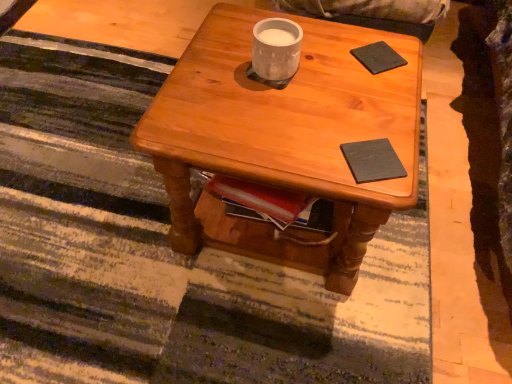
What do you see at coordinates (372, 161) in the screenshot? I see `dark matte book at center, positioned as the second pad in back-to-front order` at bounding box center [372, 161].

What do you see at coordinates (283, 138) in the screenshot? I see `wooden coffee table at center` at bounding box center [283, 138].

The image size is (512, 384). I want to click on dark matte book at center, the second pad from the top, so click(x=372, y=161).

Measure the distance between dark matte book at center, the 1th pad positioned from the bottom, and wooden coffee table at center.

They are 11.14 inches apart.

Consider the image. Between dark matte book at center, positioned as the second pad in back-to-front order, and wooden coffee table at center, which one has larger width?

wooden coffee table at center is wider.

Which is further, (362, 153) or (158, 139)?

Point (158, 139)

From the picture: Could you tell me if dark matte book at center, which is the first pad from front to back, is turned towards wooden coffee table at center?

Yes, dark matte book at center, which is the first pad from front to back, is turned towards wooden coffee table at center.

From a real-world perspective, is black matte pad at upper right, which is the first pad in top-to-bottom order, physically located above or below wooden coffee table at center?

Clearly, from a real-world perspective, black matte pad at upper right, which is the first pad in top-to-bottom order, is above wooden coffee table at center.

This screenshot has width=512, height=384. Find the location of `desk that is in front of the black matte pad at upper right, the second pad in the front-to-back sequence`. desk that is in front of the black matte pad at upper right, the second pad in the front-to-back sequence is located at coordinates (283, 138).

How many degrees apart are the facing directions of black matte pad at upper right, placed as the second pad when sorted from bottom to top, and wooden coffee table at center?

They differ by 45.8 degrees in their facing directions.

Based on their positions, is black matte pad at upper right, placed as the second pad when sorted from bottom to top, located to the left or right of wooden coffee table at center?

From the image, it's evident that black matte pad at upper right, placed as the second pad when sorted from bottom to top, is to the right of wooden coffee table at center.

In terms of width, does black matte pad at upper right, placed as the second pad when sorted from bottom to top, look wider or thinner when compared to white matte cup at center?

black matte pad at upper right, placed as the second pad when sorted from bottom to top, is wider than white matte cup at center.

Is black matte pad at upper right, which is the first pad in top-to-bottom order, facing away from white matte cup at center?

black matte pad at upper right, which is the first pad in top-to-bottom order, is not turned away from white matte cup at center.

From the image's perspective, would you say black matte pad at upper right, placed as the second pad when sorted from bottom to top, is positioned over white matte cup at center?

Yes, from the image's perspective, black matte pad at upper right, placed as the second pad when sorted from bottom to top, is on top of white matte cup at center.

From the image's perspective, between black matte pad at upper right, which is the first pad in top-to-bottom order, and dark matte book at center, which is the first pad from front to back, who is located below?

dark matte book at center, which is the first pad from front to back, from the image's perspective.

Can you tell me how much black matte pad at upper right, the second pad in the front-to-back sequence, and dark matte book at center, the second pad from the top, differ in facing direction?

The angular difference between black matte pad at upper right, the second pad in the front-to-back sequence, and dark matte book at center, the second pad from the top, is 74.3 degrees.

Does black matte pad at upper right, the first pad viewed from the back, have a greater width compared to dark matte book at center, the second pad from the top?

Yes, black matte pad at upper right, the first pad viewed from the back, is wider than dark matte book at center, the second pad from the top.

Is white matte cup at center not within dark matte book at center, which is the first pad from front to back?

Indeed, white matte cup at center is completely outside dark matte book at center, which is the first pad from front to back.

From a real-world perspective, is white matte cup at center physically above dark matte book at center, the second pad from the top?

Yes, from a real-world perspective, white matte cup at center is above dark matte book at center, the second pad from the top.

Locate an element on the screen. The width and height of the screenshot is (512, 384). pad that is the 1st object to the right of the white matte cup at center, starting at the anchor is located at coordinates (372, 161).

What's the angular difference between white matte cup at center and dark matte book at center, positioned as the second pad in back-to-front order,'s facing directions?

120 degrees separate the facing orientations of white matte cup at center and dark matte book at center, positioned as the second pad in back-to-front order.

Considering the positions of objects wooden coffee table at center and dark matte book at center, positioned as the second pad in back-to-front order, in the image provided, who is more to the left, wooden coffee table at center or dark matte book at center, positioned as the second pad in back-to-front order,?

wooden coffee table at center.

Which is in front, point (315, 89) or point (366, 157)?

The point (366, 157) is more forward.

Can you confirm if wooden coffee table at center is wider than dark matte book at center, positioned as the second pad in back-to-front order?

Indeed, wooden coffee table at center has a greater width compared to dark matte book at center, positioned as the second pad in back-to-front order.

Can you tell me how much white matte cup at center and black matte pad at upper right, the second pad in the front-to-back sequence, differ in facing direction?

There is a 45.6-degree angle between the facing directions of white matte cup at center and black matte pad at upper right, the second pad in the front-to-back sequence.

From a real-world perspective, is white matte cup at center over black matte pad at upper right, the second pad in the front-to-back sequence?

Yes.

Does point (259, 26) come farther from viewer compared to point (362, 46)?

That is False.

Who is shorter, white matte cup at center or black matte pad at upper right, the first pad viewed from the back?

black matte pad at upper right, the first pad viewed from the back, is shorter.

The width and height of the screenshot is (512, 384). I want to click on the 1st pad to the right when counting from the wooden coffee table at center, so click(372, 161).

From a real-world perspective, which pad is the 2nd one above the wooden coffee table at center? Please provide its 2D coordinates.

[(378, 57)]

Looking at the image, which one is located closer to white matte cup at center, black matte pad at upper right, which is the first pad in top-to-bottom order, or wooden coffee table at center?

black matte pad at upper right, which is the first pad in top-to-bottom order, lies closer to white matte cup at center than the other object.

Looking at the image, which one is located further to black matte pad at upper right, the first pad viewed from the back, white matte cup at center or wooden coffee table at center?

wooden coffee table at center.

Based on their spatial positions, is dark matte book at center, the second pad from the top, or black matte pad at upper right, which is the first pad in top-to-bottom order, further from wooden coffee table at center?

black matte pad at upper right, which is the first pad in top-to-bottom order, is positioned further to the anchor wooden coffee table at center.

In the scene shown: Looking at the image, which one is located closer to dark matte book at center, the second pad from the top, black matte pad at upper right, the first pad viewed from the back, or white matte cup at center?

white matte cup at center is closer to dark matte book at center, the second pad from the top.

Considering their positions, is wooden coffee table at center positioned further to dark matte book at center, the 1th pad positioned from the bottom, than white matte cup at center?

wooden coffee table at center lies further to dark matte book at center, the 1th pad positioned from the bottom, than the other object.

Estimate the real-world distances between objects in this image. Which object is further from white matte cup at center, wooden coffee table at center or black matte pad at upper right, which is the first pad in top-to-bottom order?

Among the two, wooden coffee table at center is located further to white matte cup at center.

Considering their positions, is wooden coffee table at center positioned closer to dark matte book at center, the 1th pad positioned from the bottom, than black matte pad at upper right, placed as the second pad when sorted from bottom to top?

wooden coffee table at center.

Based on their spatial positions, is dark matte book at center, the 1th pad positioned from the bottom, or white matte cup at center closer to black matte pad at upper right, the second pad in the front-to-back sequence?

white matte cup at center is positioned closer to the anchor black matte pad at upper right, the second pad in the front-to-back sequence.

The width and height of the screenshot is (512, 384). I want to click on desk between white matte cup at center and dark matte book at center, the second pad from the top, from top to bottom, so click(283, 138).

Where is `desk that lies between black matte pad at upper right, placed as the second pad when sorted from bottom to top, and dark matte book at center, which is the first pad from front to back, from top to bottom`? desk that lies between black matte pad at upper right, placed as the second pad when sorted from bottom to top, and dark matte book at center, which is the first pad from front to back, from top to bottom is located at coordinates (283, 138).

The width and height of the screenshot is (512, 384). I want to click on desk between white matte cup at center and black matte pad at upper right, the first pad viewed from the back, in the horizontal direction, so click(283, 138).

Where is `coffee cup between black matte pad at upper right, placed as the second pad when sorted from bottom to top, and dark matte book at center, which is the first pad from front to back, in the up-down direction`? The image size is (512, 384). coffee cup between black matte pad at upper right, placed as the second pad when sorted from bottom to top, and dark matte book at center, which is the first pad from front to back, in the up-down direction is located at coordinates (276, 49).